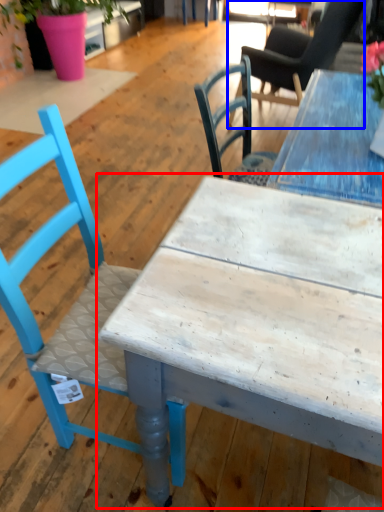
Question: Which object appears closest to the camera in this image, table (highlighted by a red box) or chair (highlighted by a blue box)?

Choices:
 (A) table
 (B) chair

Answer: (A)